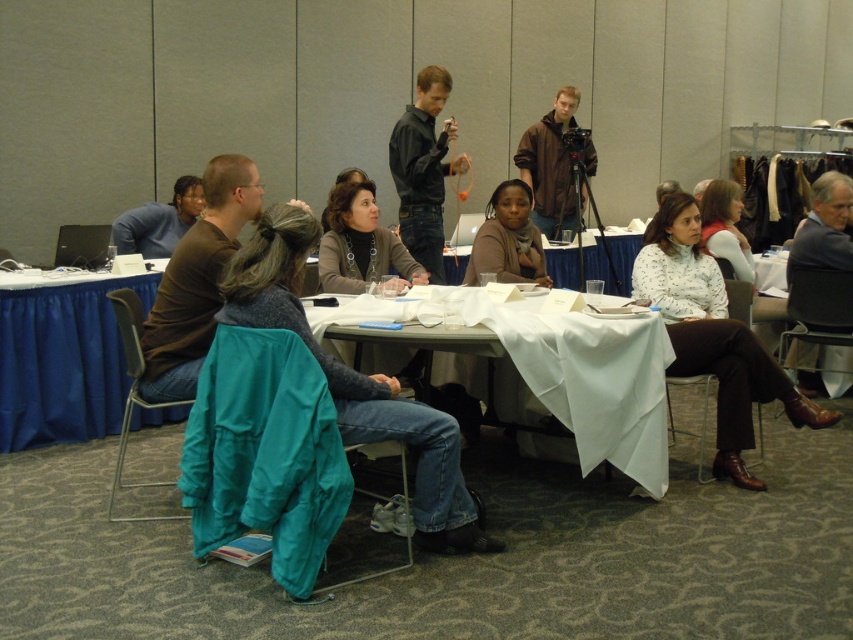
Question: Does blue fabric table at left have a smaller size compared to dark gray shirt at center?

Choices:
 (A) yes
 (B) no

Answer: (B)

Question: Among these objects, which one is farthest from the camera?

Choices:
 (A) white matte blouse at center
 (B) white cloth table at center
 (C) blue fabric table at left

Answer: (C)

Question: Which point appears farthest from the camera in this image?

Choices:
 (A) (561, 160)
 (B) (148, 244)

Answer: (A)

Question: Which of the following is the closest to the observer?

Choices:
 (A) dark gray sweater at right
 (B) white matte blouse at center

Answer: (B)

Question: Is brown leather jacket at upper center thinner than white paper at center?

Choices:
 (A) yes
 (B) no

Answer: (A)

Question: Where is blue fabric table at left located in relation to dark gray sweater at right in the image?

Choices:
 (A) below
 (B) above

Answer: (A)